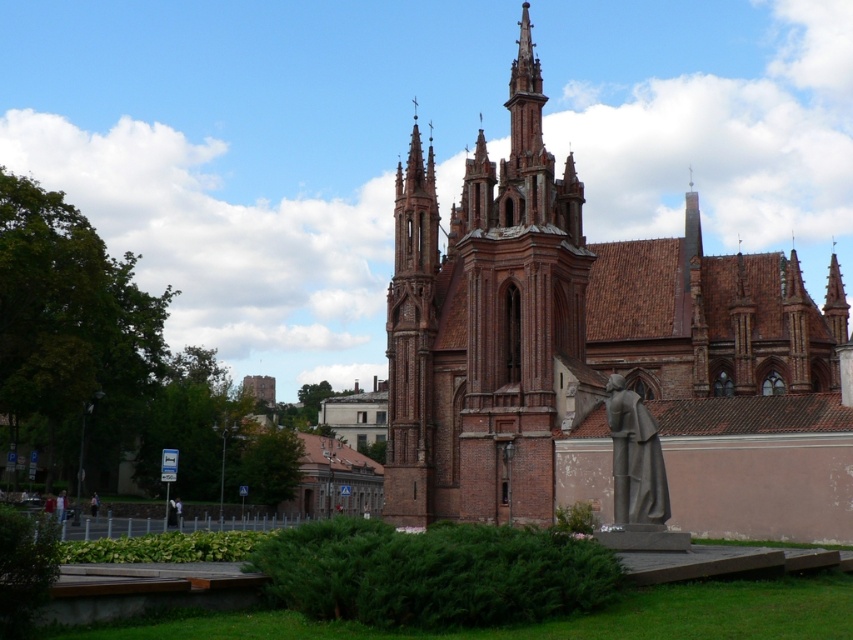
You are a photographer planning to take a wide shot of the red brick church at center and the bronze statue at lower right. Based on their positions, which object will appear larger in the photo?

The red brick church at center appears larger in the photo because it is positioned over the bronze statue at lower right, indicating it is closer to the camera and thus larger in the frame.

You are standing in the churchyard and see the red brick church at center and the light brown fabric jacket at lower left. Which object is positioned to the left of the other?

The light brown fabric jacket at lower left is positioned to the left of the red brick church at center.

You are standing at the center of the image and want to locate the bronze statue at lower right. According to the coordinates provided, in which direction should you move to find it?

The bronze statue at lower right is located at coordinates point [635,460], so you should move towards the lower right direction to find it.